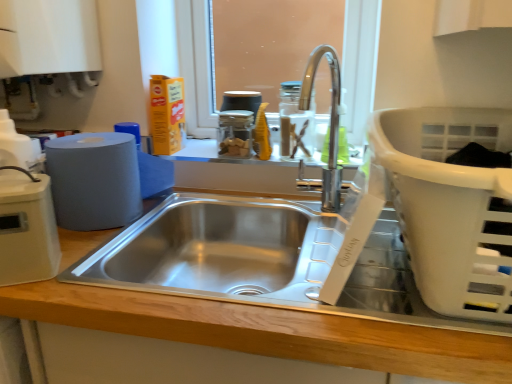
This screenshot has width=512, height=384. What do you see at coordinates (450, 205) in the screenshot?
I see `white plastic laundry basket at right` at bounding box center [450, 205].

Measure the distance between clear glass jar at center and camera.

1.15 meters.

This screenshot has width=512, height=384. What do you see at coordinates (295, 122) in the screenshot?
I see `clear glass jar at center` at bounding box center [295, 122].

What is the approximate width of transparent glass window screen at upper center?

transparent glass window screen at upper center is 2.40 inches wide.

You are a GUI agent. You are given a task and a screenshot of the screen. Output one action in this format:
    pyautogui.click(x=<x>, y=<y>)
    Task: Click on the white plastic laundry basket at right
    
    Given the screenshot: What is the action you would take?
    pyautogui.click(x=450, y=205)

Which of these two, transparent glass jar at center, the first appliance viewed from the right, or clear glass jar at center, is smaller?

Smaller between the two is transparent glass jar at center, the first appliance viewed from the right.

Is transparent glass jar at center, the first appliance positioned from the top, oriented away from clear glass jar at center?

No, transparent glass jar at center, the first appliance positioned from the top,'s orientation is not away from clear glass jar at center.

Considering the relative sizes of transparent glass jar at center, the first appliance in the back-to-front sequence, and clear glass jar at center in the image provided, is transparent glass jar at center, the first appliance in the back-to-front sequence, taller than clear glass jar at center?

No.

Considering the relative positions of white plastic laundry basket at right and transparent glass jar at center, the first appliance in the back-to-front sequence, in the image provided, is white plastic laundry basket at right to the left of transparent glass jar at center, the first appliance in the back-to-front sequence, from the viewer's perspective?

In fact, white plastic laundry basket at right is to the right of transparent glass jar at center, the first appliance in the back-to-front sequence.

From a real-world perspective, which object rests below the other?

In real-world perspective, white plastic laundry basket at right is lower.

From the image's perspective, is white plastic laundry basket at right located beneath transparent glass jar at center, the first appliance in the back-to-front sequence?

Indeed, from the image's perspective, white plastic laundry basket at right is shown beneath transparent glass jar at center, the first appliance in the back-to-front sequence.

Is white plastic laundry basket at right situated inside transparent glass jar at center, the first appliance positioned from the top, or outside?

white plastic laundry basket at right is located beyond the bounds of transparent glass jar at center, the first appliance positioned from the top.

Does beige plastic toaster at left, which is the 2th appliance from top to bottom, appear on the right side of matte gray paper towel at left?

In fact, beige plastic toaster at left, which is the 2th appliance from top to bottom, is to the left of matte gray paper towel at left.

Which of these two, beige plastic toaster at left, which ranks as the 2th appliance in back-to-front order, or matte gray paper towel at left, stands shorter?

matte gray paper towel at left.

From the image's perspective, which is below, beige plastic toaster at left, acting as the 1th appliance starting from the bottom, or matte gray paper towel at left?

beige plastic toaster at left, acting as the 1th appliance starting from the bottom.

From the image's perspective, is matte gray paper towel at left located beneath transparent glass window screen at upper center?

Indeed, from the image's perspective, matte gray paper towel at left is shown beneath transparent glass window screen at upper center.

Is matte gray paper towel at left looking in the opposite direction of transparent glass window screen at upper center?

That's not correct — matte gray paper towel at left is not looking away from transparent glass window screen at upper center.

In the image, there is a matte gray paper towel at left. What are the coordinates of `window screen above it (from the image's perspective)` in the screenshot? It's located at (360, 63).

Does point (79, 229) come behind point (201, 79)?

No, it is in front of (201, 79).

Does point (39, 194) lie in front of point (70, 284)?

Yes, point (39, 194) is closer to viewer.

From the picture: From a real-world perspective, which object rests below the other?

wooden counter at center.

Is beige plastic toaster at left, which ranks as the 2th appliance in back-to-front order, wider or thinner than wooden counter at center?

Considering their sizes, beige plastic toaster at left, which ranks as the 2th appliance in back-to-front order, looks slimmer than wooden counter at center.

Between beige plastic toaster at left, which is the second appliance in right-to-left order, and wooden counter at center, which one has smaller size?

Smaller between the two is beige plastic toaster at left, which is the second appliance in right-to-left order.

Is beige plastic toaster at left, which ranks as the 2th appliance in back-to-front order, located within clear glass jar at center?

Actually, beige plastic toaster at left, which ranks as the 2th appliance in back-to-front order, is outside clear glass jar at center.

Is clear glass jar at center to the left of beige plastic toaster at left, which appears as the first appliance when viewed from the front, from the viewer's perspective?

In fact, clear glass jar at center is to the right of beige plastic toaster at left, which appears as the first appliance when viewed from the front.

Which of these two, clear glass jar at center or beige plastic toaster at left, which is the 2th appliance from top to bottom, stands shorter?

Standing shorter between the two is clear glass jar at center.

Identify the location of window sill above the beige plastic toaster at left, which appears as the first appliance when viewed from the front (from the image's perspective). (218, 155).

Looking at this image, would you say transparent glass jar at center, which is the second appliance from left to right, contains clear glass jar at center?

No, transparent glass jar at center, which is the second appliance from left to right, does not contain clear glass jar at center.

Is transparent glass jar at center, the first appliance in the back-to-front sequence, not close to clear glass jar at center?

No, transparent glass jar at center, the first appliance in the back-to-front sequence, is in close proximity to clear glass jar at center.

From the image's perspective, is transparent glass jar at center, the second appliance from the front, above or below clear glass jar at center?

From the image's perspective, transparent glass jar at center, the second appliance from the front, appears above clear glass jar at center.

Identify the location of appliance behind the clear glass jar at center. This screenshot has height=384, width=512. (234, 133).

You are a GUI agent. You are given a task and a screenshot of the screen. Output one action in this format:
    pyautogui.click(x=<x>, y=<y>)
    Task: Click on the appliance above the white plastic laundry basket at right (from the image's perspective)
    The image size is (512, 384).
    Given the screenshot: What is the action you would take?
    pyautogui.click(x=234, y=133)

Looking at the image, which one is located closer to transparent glass window screen at upper center, transparent glass jar at center, the first appliance positioned from the top, or matte gray paper towel at left?

transparent glass jar at center, the first appliance positioned from the top, lies closer to transparent glass window screen at upper center than the other object.

Based on their spatial positions, is white plastic laundry basket at right or wooden counter at center closer to beige plastic toaster at left, which is the 2th appliance from top to bottom?

wooden counter at center is positioned closer to the anchor beige plastic toaster at left, which is the 2th appliance from top to bottom.

Which object lies nearer to the anchor point transparent glass jar at center, the first appliance viewed from the right, white plastic laundry basket at right or wooden counter at center?

wooden counter at center lies closer to transparent glass jar at center, the first appliance viewed from the right, than the other object.

Estimate the real-world distances between objects in this image. Which object is closer to matte gray paper towel at left, clear glass jar at center or transparent glass window screen at upper center?

The object closer to matte gray paper towel at left is clear glass jar at center.

Estimate the real-world distances between objects in this image. Which object is closer to transparent glass window screen at upper center, matte gray paper towel at left or white plastic laundry basket at right?

matte gray paper towel at left.

Looking at the image, which one is located closer to matte gray paper towel at left, white plastic laundry basket at right or wooden counter at center?

wooden counter at center is closer to matte gray paper towel at left.

From the image, which object appears to be nearer to beige plastic toaster at left, which ranks as the 2th appliance in back-to-front order, wooden counter at center or matte gray paper towel at left?

Among the two, matte gray paper towel at left is located nearer to beige plastic toaster at left, which ranks as the 2th appliance in back-to-front order.

Considering their positions, is wooden counter at center positioned further to clear glass jar at center than clear glass jar at center?

Among the two, wooden counter at center is located further to clear glass jar at center.

Find the location of a particular element. This screenshot has width=512, height=384. appliance between beige plastic toaster at left, which ranks as the 2th appliance in back-to-front order, and transparent glass window screen at upper center in the front-back direction is located at coordinates (234, 133).

The width and height of the screenshot is (512, 384). What are the coordinates of `bottle between wooden counter at center and transparent glass jar at center, the first appliance viewed from the right, in the front-back direction` in the screenshot? It's located at (295, 122).

At what (x,y) coordinates should I click in order to perform the action: click on appliance between matte gray paper towel at left and transparent glass window screen at upper center in the horizontal direction. Please return your answer as a coordinate pair (x, y). This screenshot has height=384, width=512. Looking at the image, I should click on (234, 133).

This screenshot has height=384, width=512. Find the location of `paper towel positioned between beige plastic toaster at left, which is the second appliance in right-to-left order, and transparent glass jar at center, the first appliance positioned from the top, from near to far`. paper towel positioned between beige plastic toaster at left, which is the second appliance in right-to-left order, and transparent glass jar at center, the first appliance positioned from the top, from near to far is located at coordinates [x=94, y=180].